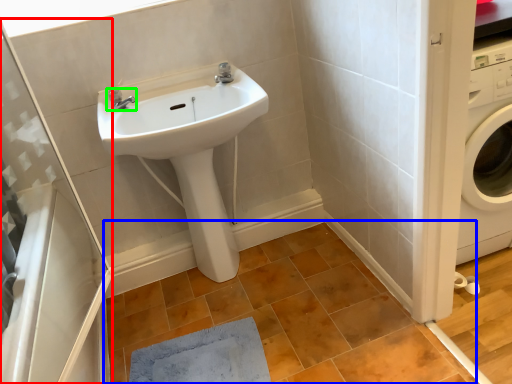
Question: Estimate the real-world distances between objects in this image. Which object is closer to shower door (highlighted by a red box), tile (highlighted by a blue box) or tap (highlighted by a green box)?

Choices:
 (A) tile
 (B) tap

Answer: (A)